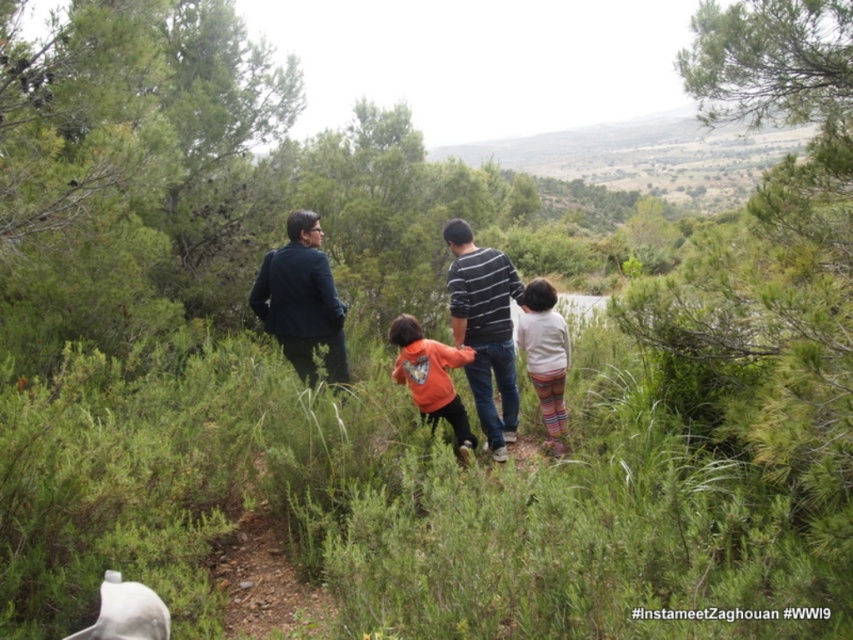
Question: Does striped cotton shirt at center have a larger size compared to dark blue suit at center?

Choices:
 (A) no
 (B) yes

Answer: (B)

Question: Which point is farther from the camera taking this photo?

Choices:
 (A) (419, 412)
 (B) (448, 308)

Answer: (B)

Question: Which object is positioned closest to the white striped sweater at center?

Choices:
 (A) orange cotton shirt at center
 (B) dark blue suit at center
 (C) orange fleece jacket at center
 (D) striped cotton shirt at center

Answer: (D)

Question: Does striped cotton shirt at center appear under white striped sweater at center?

Choices:
 (A) yes
 (B) no

Answer: (B)

Question: Is striped cotton shirt at center bigger than orange fleece jacket at center?

Choices:
 (A) no
 (B) yes

Answer: (B)

Question: Considering the real-world distances, which object is farthest from the orange cotton shirt at center?

Choices:
 (A) dark blue suit at center
 (B) white striped sweater at center
 (C) orange fleece jacket at center

Answer: (A)